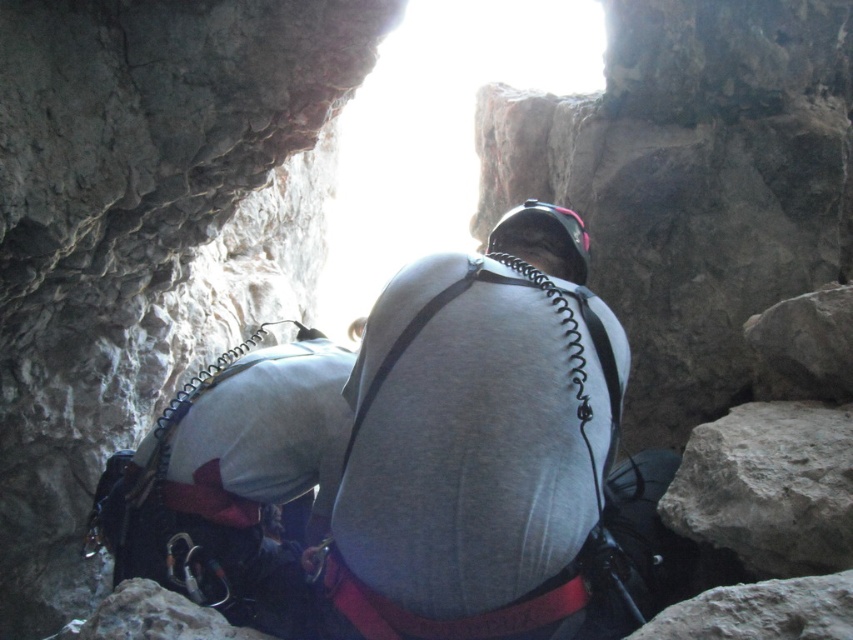
Consider the image. Measure the distance between rough textured rock at lower right and camera.

rough textured rock at lower right is 3.89 feet from camera.

Which is above, rough textured rock at lower right or smooth rock at lower left?

rough textured rock at lower right is above.

Which is behind, point (635, 634) or point (212, 634)?

The point (212, 634) is more distant.

Where is `rough textured rock at lower right`? rough textured rock at lower right is located at coordinates (759, 611).

Between gray matte shirt at center and smooth rock at lower left, which one is positioned lower?

Positioned lower is smooth rock at lower left.

Does gray matte shirt at center have a lesser height compared to smooth rock at lower left?

No, gray matte shirt at center is not shorter than smooth rock at lower left.

The width and height of the screenshot is (853, 640). Identify the location of gray matte shirt at center. (482, 444).

Who is lower down, gray matte shirt at center or rough textured rock at lower right?

rough textured rock at lower right

Is gray matte shirt at center thinner than rough textured rock at lower right?

No, gray matte shirt at center is not thinner than rough textured rock at lower right.

The height and width of the screenshot is (640, 853). I want to click on gray matte shirt at center, so click(482, 444).